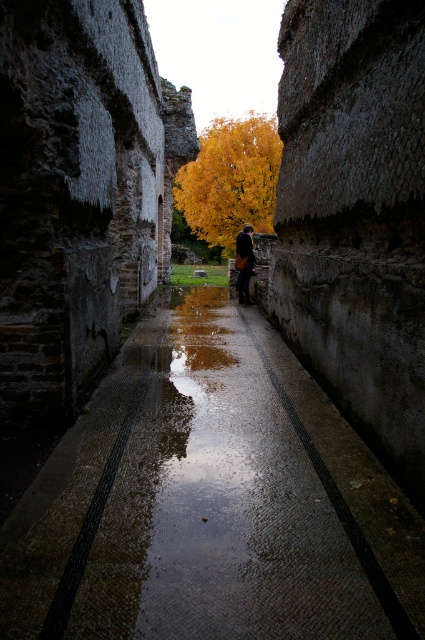
Consider the image. Who is lower down, wet concrete pavement at center or leather brown bag at center?

wet concrete pavement at center

Is point (371, 499) positioned in front of point (249, 252)?

Yes, point (371, 499) is closer to viewer.

Who is more forward, [206,472] or [238,300]?

Point [206,472] is more forward.

The image size is (425, 640). In order to click on wet concrete pavement at center in this screenshot , I will do [x=210, y=500].

Is wet concrete pavement at center closer to the viewer compared to yellow leafy tree at center?

Yes.

How much distance is there between wet concrete pavement at center and yellow leafy tree at center?

wet concrete pavement at center and yellow leafy tree at center are 37.07 meters apart from each other.

Image resolution: width=425 pixels, height=640 pixels. What do you see at coordinates (210, 500) in the screenshot?
I see `wet concrete pavement at center` at bounding box center [210, 500].

What are the coordinates of `wet concrete pavement at center` in the screenshot? It's located at (210, 500).

Can you confirm if yellow leafy tree at center is positioned to the left of leather brown bag at center?

In fact, yellow leafy tree at center is to the right of leather brown bag at center.

Is yellow leafy tree at center wider than leather brown bag at center?

Yes, yellow leafy tree at center is wider than leather brown bag at center.

Where is `yellow leafy tree at center`? This screenshot has height=640, width=425. yellow leafy tree at center is located at coordinates (231, 179).

What are the coordinates of `yellow leafy tree at center` in the screenshot? It's located at (231, 179).